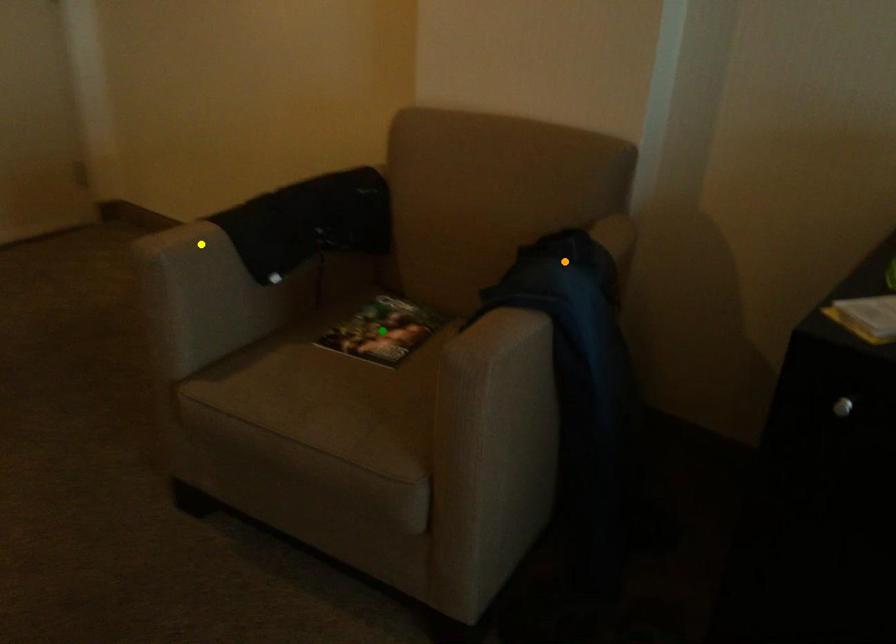
Order these from nearest to farthest:
green point | yellow point | orange point

1. orange point
2. yellow point
3. green point